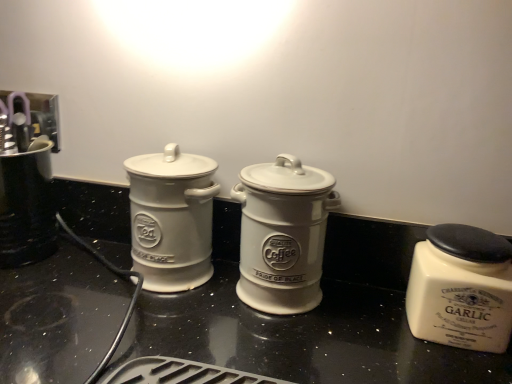
Question: Which direction should I rotate to face white ceramic coffee canister at center, arranged as the 2th kitchen appliance when viewed from the left, — up or down?

Choices:
 (A) down
 (B) up

Answer: (A)

Question: Is white ceramic garlic jar at right, which is the 1th kitchen appliance in right-to-left order, positioned with its back to brushed metal coffee maker at left?

Choices:
 (A) no
 (B) yes

Answer: (A)

Question: From a real-world perspective, is white ceramic garlic jar at right, the third kitchen appliance from the left, on brushed metal coffee maker at left?

Choices:
 (A) yes
 (B) no

Answer: (B)

Question: Is white ceramic garlic jar at right, which is the 1th kitchen appliance in right-to-left order, in contact with brushed metal coffee maker at left?

Choices:
 (A) yes
 (B) no

Answer: (B)

Question: Is white ceramic garlic jar at right, the third kitchen appliance from the left, outside brushed metal coffee maker at left?

Choices:
 (A) yes
 (B) no

Answer: (A)

Question: Can you confirm if white ceramic garlic jar at right, the third kitchen appliance from the left, is positioned to the left of brushed metal coffee maker at left?

Choices:
 (A) yes
 (B) no

Answer: (B)

Question: Can you confirm if white ceramic garlic jar at right, the third kitchen appliance from the left, is positioned to the right of brushed metal coffee maker at left?

Choices:
 (A) yes
 (B) no

Answer: (A)

Question: Is white ceramic coffee canister at center, arranged as the 2th kitchen appliance when viewed from the left, further to the viewer compared to brushed metal coffee maker at left?

Choices:
 (A) yes
 (B) no

Answer: (B)

Question: Can you confirm if white ceramic coffee canister at center, arranged as the 2th kitchen appliance when viewed from the left, is bigger than brushed metal coffee maker at left?

Choices:
 (A) no
 (B) yes

Answer: (A)

Question: From a real-world perspective, is white ceramic coffee canister at center, arranged as the 2th kitchen appliance when viewed from the left, over brushed metal coffee maker at left?

Choices:
 (A) yes
 (B) no

Answer: (A)

Question: Does white ceramic coffee canister at center, arranged as the 2th kitchen appliance when viewed from the left, appear on the right side of brushed metal coffee maker at left?

Choices:
 (A) no
 (B) yes

Answer: (B)

Question: Does white ceramic coffee canister at center, acting as the 2th kitchen appliance starting from the right, have a lesser height compared to brushed metal coffee maker at left?

Choices:
 (A) yes
 (B) no

Answer: (B)

Question: Is white ceramic coffee canister at center, acting as the 2th kitchen appliance starting from the right, at the left side of brushed metal coffee maker at left?

Choices:
 (A) yes
 (B) no

Answer: (B)

Question: Is white ceramic coffee canister at center, arranged as the 2th kitchen appliance when viewed from the left, completely or partially outside of white ceramic jar at left, positioned as the 1th kitchen appliance in left-to-right order?

Choices:
 (A) no
 (B) yes

Answer: (B)